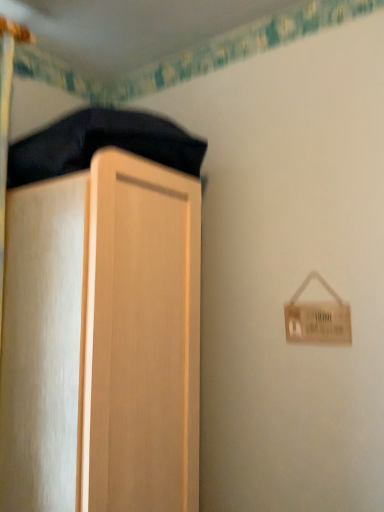
Question: Does light wood cupboard at left have a lesser height compared to velvet dark blue blanket at upper left?

Choices:
 (A) yes
 (B) no

Answer: (B)

Question: Is light wood cupboard at left further to camera compared to velvet dark blue blanket at upper left?

Choices:
 (A) yes
 (B) no

Answer: (B)

Question: Does light wood cupboard at left have a greater height compared to velvet dark blue blanket at upper left?

Choices:
 (A) yes
 (B) no

Answer: (A)

Question: Is light wood cupboard at left thinner than velvet dark blue blanket at upper left?

Choices:
 (A) no
 (B) yes

Answer: (B)

Question: From the image's perspective, is light wood cupboard at left located beneath velvet dark blue blanket at upper left?

Choices:
 (A) no
 (B) yes

Answer: (B)

Question: Is light wood cupboard at left not inside velvet dark blue blanket at upper left?

Choices:
 (A) no
 (B) yes

Answer: (B)

Question: Is velvet dark blue blanket at upper left shorter than light wood cupboard at left?

Choices:
 (A) no
 (B) yes

Answer: (B)

Question: Is velvet dark blue blanket at upper left bigger than light wood cupboard at left?

Choices:
 (A) no
 (B) yes

Answer: (A)

Question: Considering the relative sizes of velvet dark blue blanket at upper left and light wood cupboard at left in the image provided, is velvet dark blue blanket at upper left wider than light wood cupboard at left?

Choices:
 (A) no
 (B) yes

Answer: (B)

Question: Is the position of velvet dark blue blanket at upper left less distant than that of light wood cupboard at left?

Choices:
 (A) no
 (B) yes

Answer: (A)

Question: From a real-world perspective, is velvet dark blue blanket at upper left on top of light wood cupboard at left?

Choices:
 (A) no
 (B) yes

Answer: (B)

Question: From the image's perspective, is velvet dark blue blanket at upper left located beneath light wood cupboard at left?

Choices:
 (A) yes
 (B) no

Answer: (B)

Question: Do you think velvet dark blue blanket at upper left is within light wood cupboard at left, or outside of it?

Choices:
 (A) outside
 (B) inside

Answer: (A)